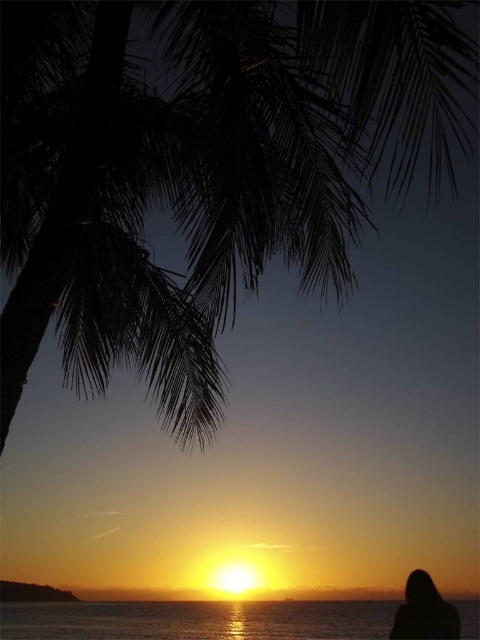
Question: Which point is closer to the camera taking this photo?

Choices:
 (A) (259, 632)
 (B) (22, 237)
 (C) (409, 577)

Answer: (C)

Question: Considering the relative positions of shiny silver water at lower center and black matte hair at lower right in the image provided, where is shiny silver water at lower center located with respect to black matte hair at lower right?

Choices:
 (A) below
 (B) above

Answer: (A)

Question: Can you confirm if shiny silver water at lower center is positioned below black matte hair at lower right?

Choices:
 (A) no
 (B) yes

Answer: (B)

Question: Can you confirm if silhouette leafy palm at upper left is positioned below shiny silver water at lower center?

Choices:
 (A) no
 (B) yes

Answer: (A)

Question: Which point is closer to the camera?

Choices:
 (A) shiny silver water at lower center
 (B) silhouette leafy palm at upper left

Answer: (B)

Question: Which of the following is the closest to the observer?

Choices:
 (A) 93,26
 (B) 204,609

Answer: (A)